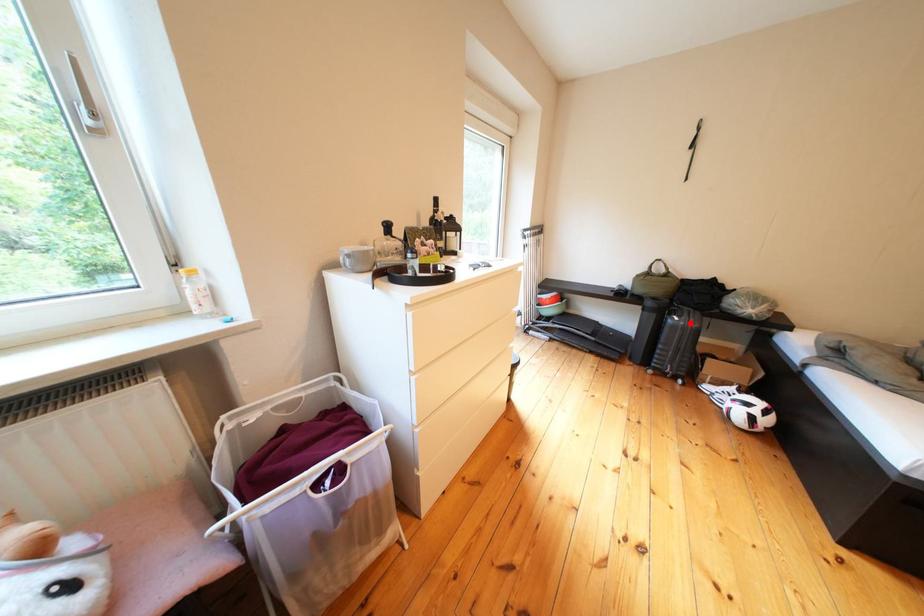
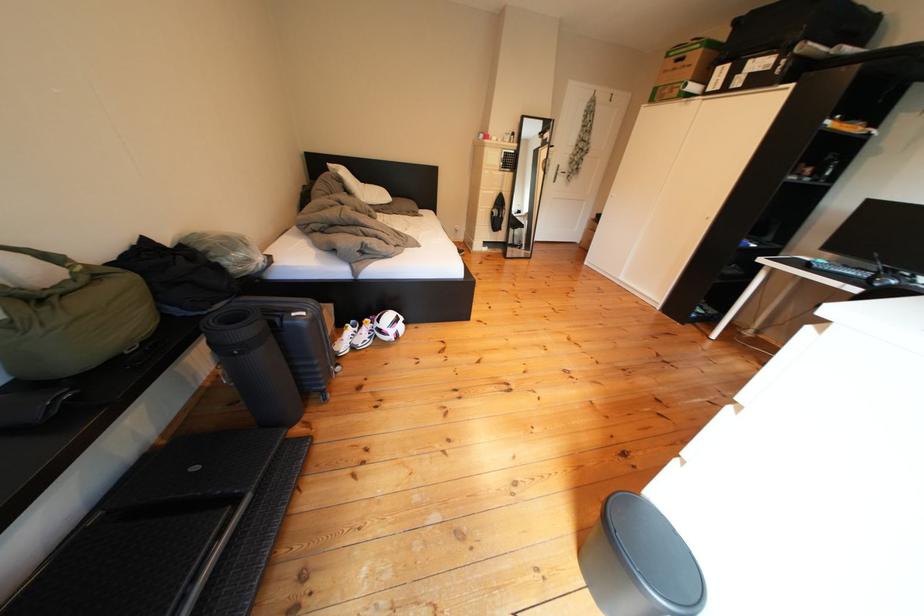
Question: I am providing you with two images of the same scene from different viewpoints. A red point is marked on the first image. Can you still see the location of the red point in image 2?

Choices:
 (A) Yes
 (B) No

Answer: (A)